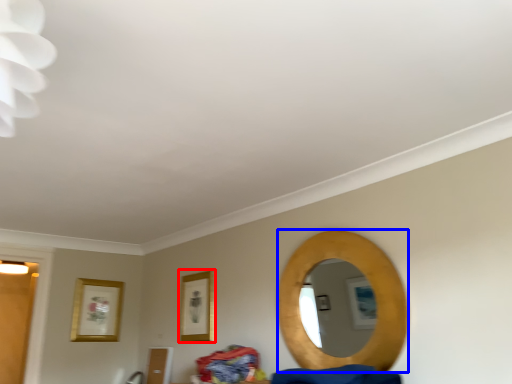
Question: Among these objects, which one is farthest to the camera, picture frame (highlighted by a red box) or mirror (highlighted by a blue box)?

Choices:
 (A) picture frame
 (B) mirror

Answer: (A)